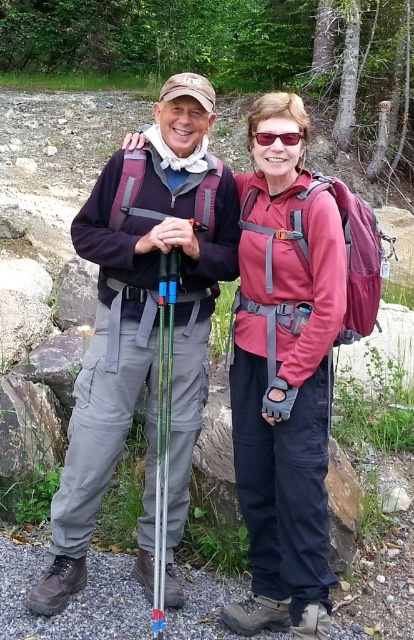
Is matte gray pants at center smaller than matte plastic sunglasses at center?

Incorrect, matte gray pants at center is not smaller in size than matte plastic sunglasses at center.

I want to click on matte gray pants at center, so click(x=144, y=328).

Find the location of `matte gray pants at center`. matte gray pants at center is located at coordinates (144, 328).

You are a GUI agent. You are given a task and a screenshot of the screen. Output one action in this format:
    pyautogui.click(x=<x>, y=<y>)
    Task: Click on the matte gray pants at center
    
    Given the screenshot: What is the action you would take?
    pyautogui.click(x=144, y=328)

Between matte gray pants at center and green metallic ski pole at center, which one has more height?

With more height is matte gray pants at center.

Is the position of matte gray pants at center more distant than that of green metallic ski pole at center?

That is True.

At what (x,y) coordinates should I click in order to perform the action: click on matte gray pants at center. Please return your answer as a coordinate pair (x, y). The image size is (414, 640). Looking at the image, I should click on (144, 328).

The image size is (414, 640). What do you see at coordinates (163, 426) in the screenshot? I see `green metallic ski pole at center` at bounding box center [163, 426].

Does point (158, 468) come in front of point (286, 145)?

No, it is not.

Between point (159, 516) and point (257, 132), which one is positioned in front?

Point (257, 132)

At what (x,y) coordinates should I click in order to perform the action: click on green metallic ski pole at center. Please return your answer as a coordinate pair (x, y). Looking at the image, I should click on (163, 426).